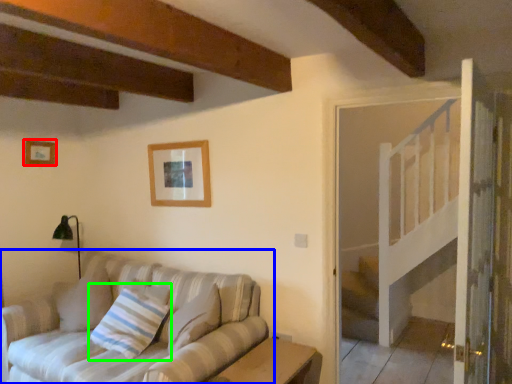
Question: Which object is the farthest from picture frame (highlighted by a red box)? Choose among these: studio couch (highlighted by a blue box) or pillow (highlighted by a green box).

Choices:
 (A) studio couch
 (B) pillow

Answer: (A)